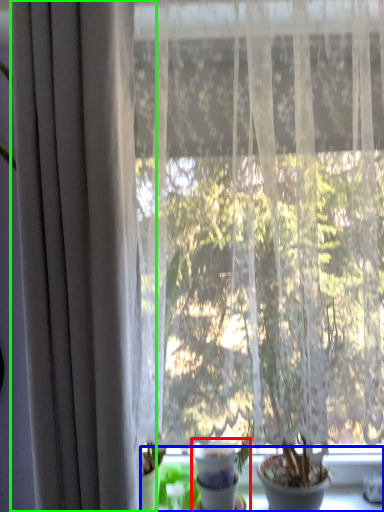
Question: Which is farther away from houseplant (highlighted by a red box)? window sill (highlighted by a blue box) or curtain (highlighted by a green box)?

Choices:
 (A) window sill
 (B) curtain

Answer: (B)